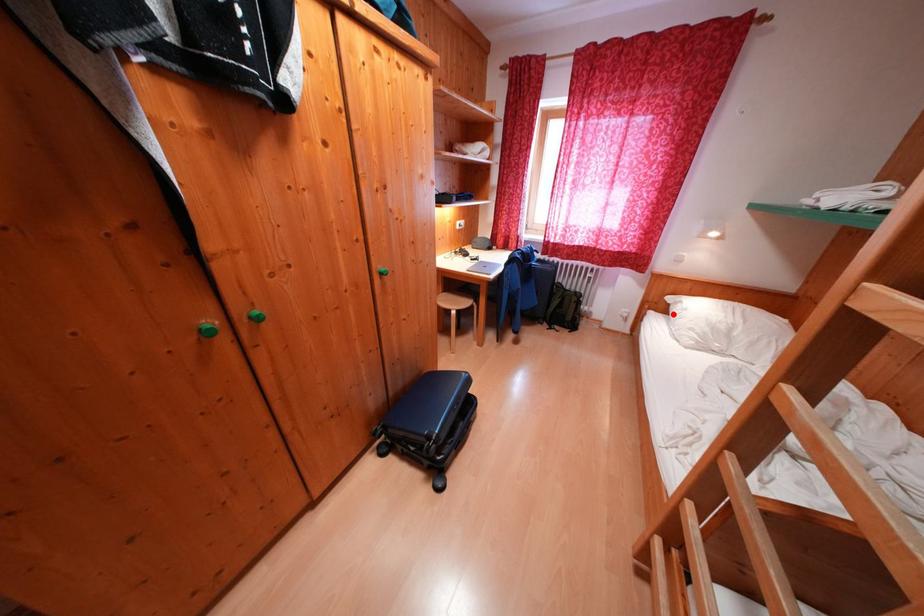
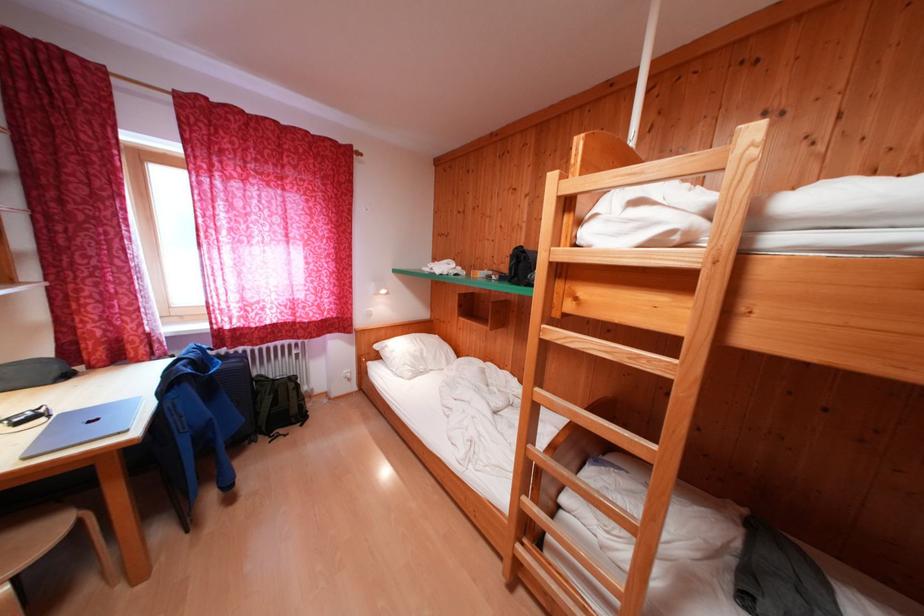
Question: I am providing you with two images of the same scene from different viewpoints. Given a red point in image1, look at the same physical point in image2. Is it:

Choices:
 (A) Closer to the viewpoint
 (B) Farther from the viewpoint

Answer: (B)